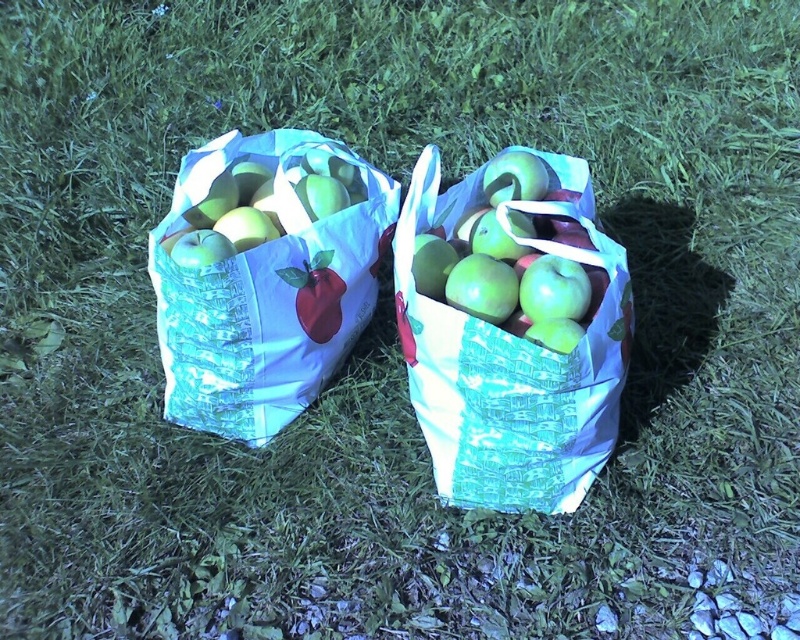
Which is above, white paper bag with apples at left or green matte apple at center?

green matte apple at center is above.

Does white paper bag with apples at left come behind green matte apple at center?

Yes.

The height and width of the screenshot is (640, 800). Identify the location of white paper bag with apples at left. (266, 285).

Locate an element on the screen. The height and width of the screenshot is (640, 800). white paper bag with apples at left is located at coordinates (266, 285).

Based on the photo, between matte white bag at center and green matte apple at center, which one is positioned higher?

green matte apple at center is above.

Does matte white bag at center have a larger size compared to green matte apple at center?

Correct, matte white bag at center is larger in size than green matte apple at center.

Measure the distance between point [584,474] and camera.

Point [584,474] is 5.42 feet from camera.

Find the location of a particular element. The width and height of the screenshot is (800, 640). matte white bag at center is located at coordinates (509, 362).

Between white paper bag with apples at left and matte white bag at center, which one appears on the right side from the viewer's perspective?

Positioned to the right is matte white bag at center.

Which is above, white paper bag with apples at left or matte white bag at center?

white paper bag with apples at left

Is point (328, 312) closer to camera compared to point (458, 316)?

That is False.

Find the location of a particular element. The image size is (800, 640). white paper bag with apples at left is located at coordinates (266, 285).